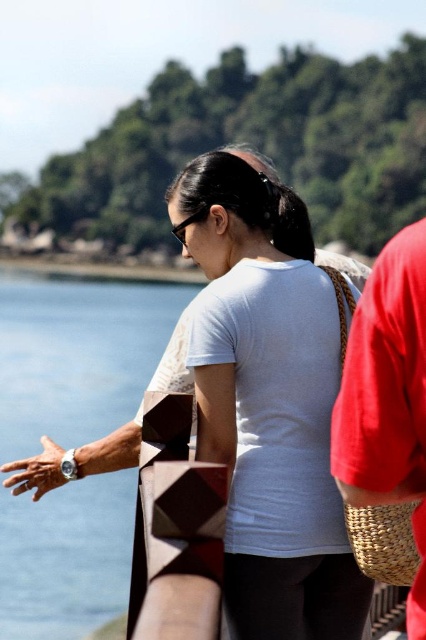
Question: Can you confirm if white matte shirt at center is positioned below transparent glass water at left?

Choices:
 (A) no
 (B) yes

Answer: (A)

Question: Is white matte shirt at center wider than transparent glass water at left?

Choices:
 (A) yes
 (B) no

Answer: (B)

Question: Which point is closer to the camera taking this photo?

Choices:
 (A) (279, 248)
 (B) (126, 563)

Answer: (A)

Question: Which of these objects is positioned closest to the transparent glass water at left?

Choices:
 (A) white matte shirt at center
 (B) red woven bag at right

Answer: (A)

Question: Which of the following is the closest to the observer?

Choices:
 (A) (394, 483)
 (B) (233, 340)

Answer: (A)

Question: Can you confirm if transparent glass water at left is positioned to the left of red woven bag at right?

Choices:
 (A) no
 (B) yes

Answer: (B)